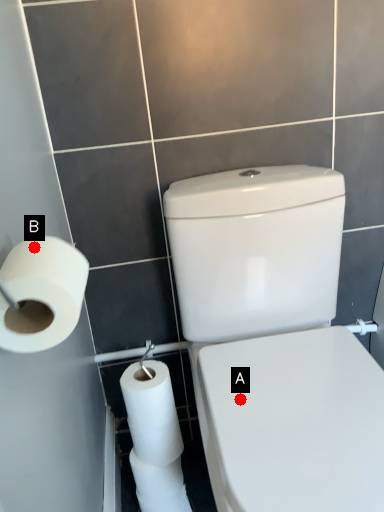
Question: Two points are circled on the image, labeled by A and B beside each circle. Which point is further to the camera?

Choices:
 (A) A is further
 (B) B is further

Answer: (A)